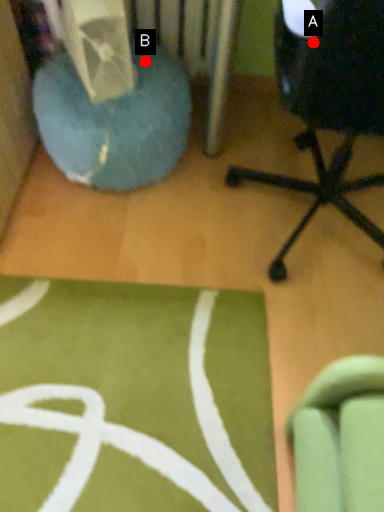
Question: Two points are circled on the image, labeled by A and B beside each circle. Which of the following is the farthest from the observer?

Choices:
 (A) A is further
 (B) B is further

Answer: (B)